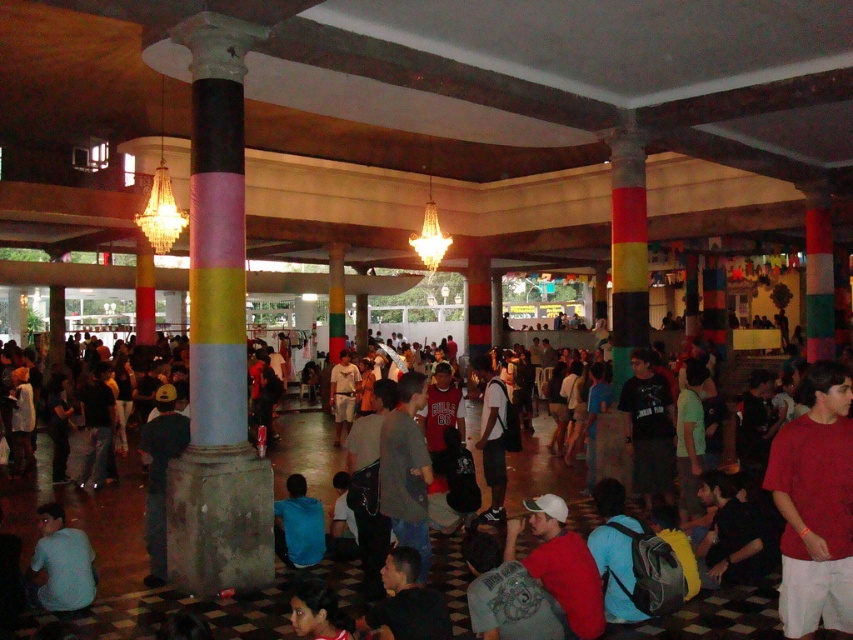
Question: Which object is closer to the camera taking this photo?

Choices:
 (A) light blue shirt at lower left
 (B) red cotton t-shirt at lower right
 (C) gray cotton shirt at center

Answer: (B)

Question: Estimate the real-world distances between objects in this image. Which object is closer to the red cotton t-shirt at lower right?

Choices:
 (A) light blue shirt at lower left
 (B) blue fabric shirt at lower center

Answer: (B)

Question: Which object is the farthest from the red cotton t-shirt at lower right?

Choices:
 (A) blue fabric shirt at lower center
 (B) light blue shirt at lower left

Answer: (B)

Question: Where is gray cotton shirt at center located in relation to light blue shirt at lower left in the image?

Choices:
 (A) above
 (B) below

Answer: (A)

Question: Considering the relative positions of red cotton t-shirt at lower right and light blue shirt at lower left in the image provided, where is red cotton t-shirt at lower right located with respect to light blue shirt at lower left?

Choices:
 (A) left
 (B) right

Answer: (B)

Question: Is gray cotton shirt at center positioned in front of light blue shirt at lower left?

Choices:
 (A) yes
 (B) no

Answer: (A)